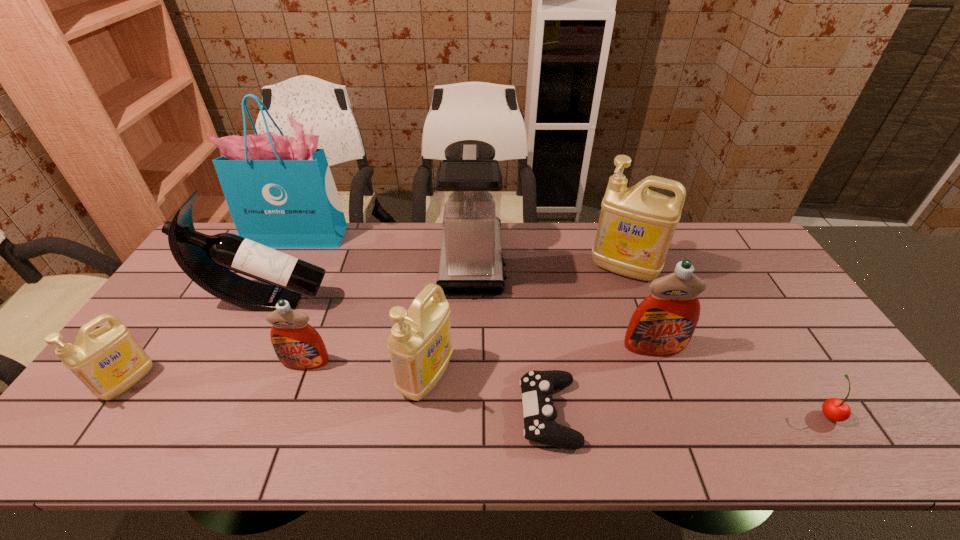
Where is `the tallest object`? the tallest object is located at coordinates (280, 191).

Find the location of a particular element. shopping bag is located at coordinates (280, 191).

You are a GUI agent. You are given a task and a screenshot of the screen. Output one action in this format:
    pyautogui.click(x=<x>, y=<y>)
    Task: Click on the coffee maker
    The height and width of the screenshot is (540, 960).
    Given the screenshot: What is the action you would take?
    pyautogui.click(x=468, y=186)

Locate an element on the screen. the biggest beige detergent is located at coordinates (x=636, y=225).

What are the coordinates of `the tallest detergent` in the screenshot? It's located at (636, 225).

What are the coordinates of `black wine bottle` in the screenshot? It's located at (207, 260).

The width and height of the screenshot is (960, 540). In order to click on the third detergent from right to left in this screenshot , I will do `click(420, 348)`.

Locate an element on the screen. This screenshot has height=540, width=960. the second biggest beige detergent is located at coordinates (420, 348).

The image size is (960, 540). I want to click on the bigger red detergent, so click(663, 323).

Where is `the leftmost object`? the leftmost object is located at coordinates (109, 360).